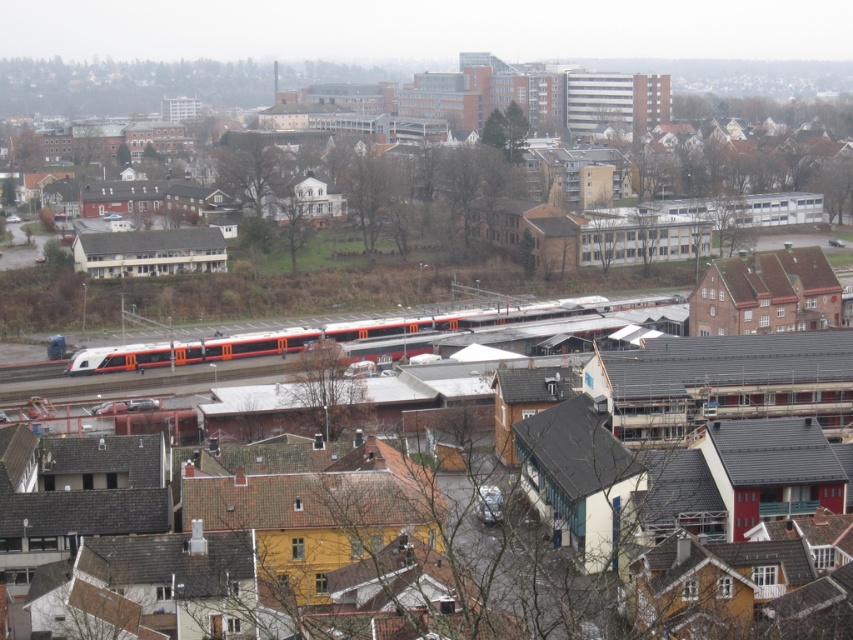
In the scene shown: Between matte orange train at center and orange metallic train at center, which one is positioned lower?

orange metallic train at center

Between point (111, 61) and point (283, 346), which one is positioned behind?

The point (111, 61) is more distant.

Where is `matte orange train at center`? The image size is (853, 640). matte orange train at center is located at coordinates (125, 84).